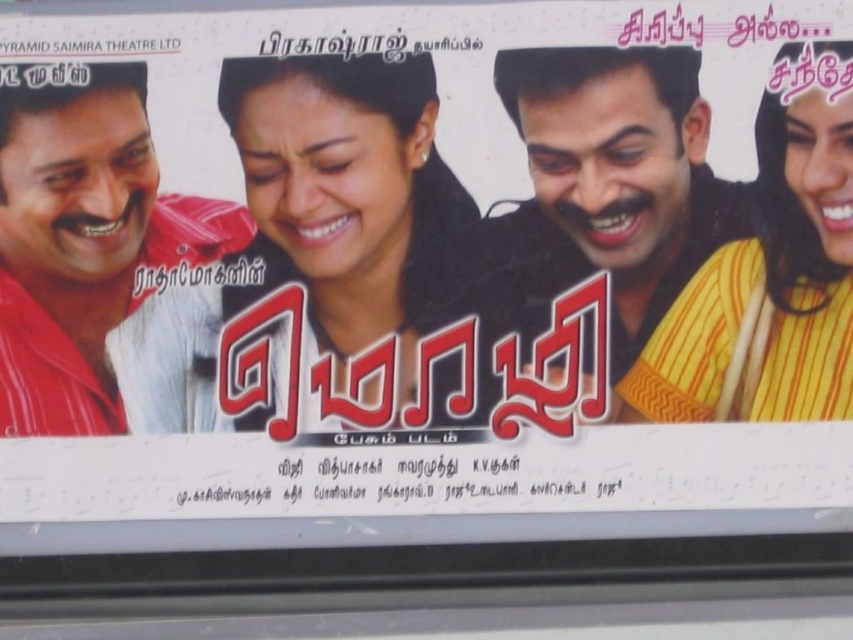
Question: Which point is closer to the camera?

Choices:
 (A) (688, 240)
 (B) (209, 243)
 (C) (787, 156)

Answer: (C)

Question: Is matte red shirt at left further to the viewer compared to yellow striped sari at right?

Choices:
 (A) no
 (B) yes

Answer: (B)

Question: Which object appears farthest from the camera in this image?

Choices:
 (A) matte red shirt at left
 (B) yellow striped shirt at right
 (C) yellow striped sari at right

Answer: (A)

Question: Observing the image, what is the correct spatial positioning of yellow striped shirt at right in reference to yellow striped sari at right?

Choices:
 (A) below
 (B) above

Answer: (B)

Question: Is yellow striped shirt at right further to the viewer compared to matte red shirt at left?

Choices:
 (A) yes
 (B) no

Answer: (B)

Question: Which of the following is the farthest from the observer?

Choices:
 (A) yellow striped sari at right
 (B) matte red shirt at left
 (C) yellow striped shirt at right

Answer: (B)